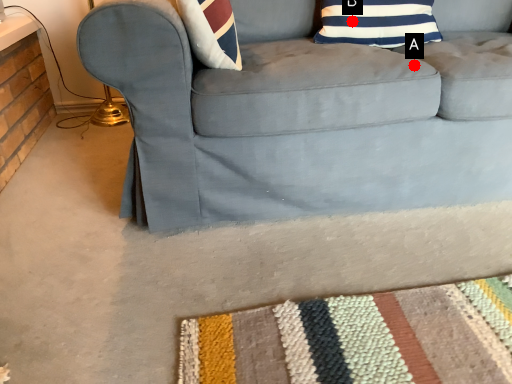
Question: Two points are circled on the image, labeled by A and B beside each circle. Which point is further to the camera?

Choices:
 (A) A is further
 (B) B is further

Answer: (B)